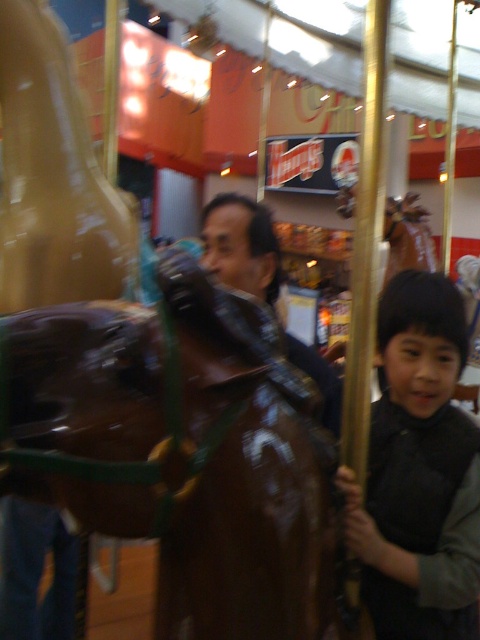
You are a customer in the mall and see two jackets displayed in the store window. The smooth black jacket at right and the shiny brown leather jacket at center. Which jacket is placed lower in the display?

The smooth black jacket at right is below the shiny brown leather jacket at center, so it is placed lower in the display.

Based on the photo, you are a delivery person carrying a large box that is 1.2 meters wide. You need to pass through the space between the shiny brown horse at center and the shiny brown leather jacket at center. Can you fit through the space?

The shiny brown horse at center might be wider than shiny brown leather jacket at center, so the space between them may not be wide enough for your 1.2 meter wide box. You should check the actual width before proceeding.

You are a person standing in the shopping mall and see the shiny brown horse at center and the smooth black jacket at right. Which object is higher in position?

The shiny brown horse at center is located above the smooth black jacket at right, so it is higher in position.